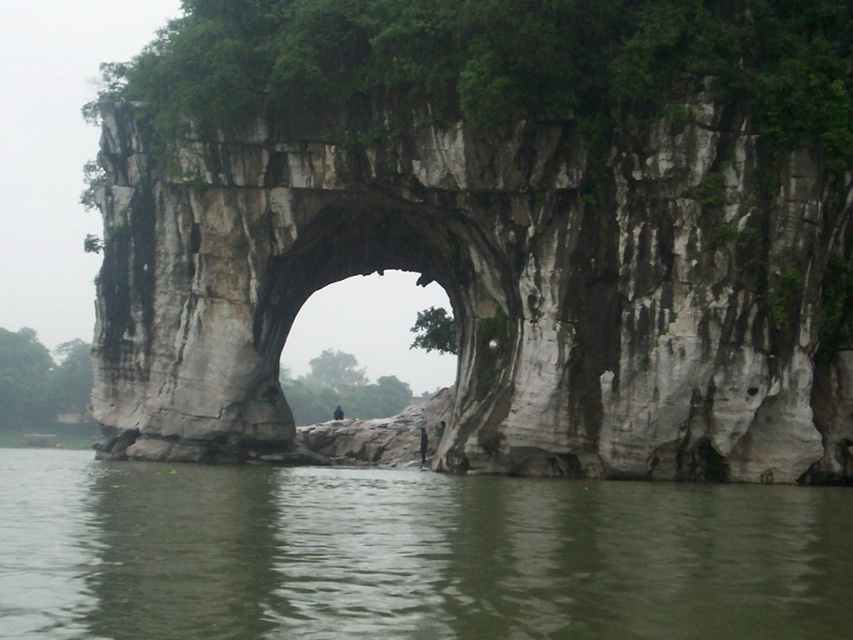
Question: Which object is positioned closest to the white stone rock arch at center?

Choices:
 (A) gray/weathered stone arch at center
 (B) greenish-gray water at center

Answer: (A)

Question: Is gray/weathered stone arch at center to the right of greenish-gray water at center from the viewer's perspective?

Choices:
 (A) yes
 (B) no

Answer: (B)

Question: Which point appears closest to the camera in this image?

Choices:
 (A) (387, 205)
 (B) (529, 307)
 (C) (357, 484)

Answer: (C)

Question: Among these points, which one is farthest from the camera?

Choices:
 (A) (457, 234)
 (B) (518, 276)
 (C) (257, 545)

Answer: (A)

Question: Can you confirm if gray/weathered stone arch at center is wider than greenish-gray water at center?

Choices:
 (A) yes
 (B) no

Answer: (B)

Question: Is gray/weathered stone arch at center closer to camera compared to white stone rock arch at center?

Choices:
 (A) yes
 (B) no

Answer: (A)